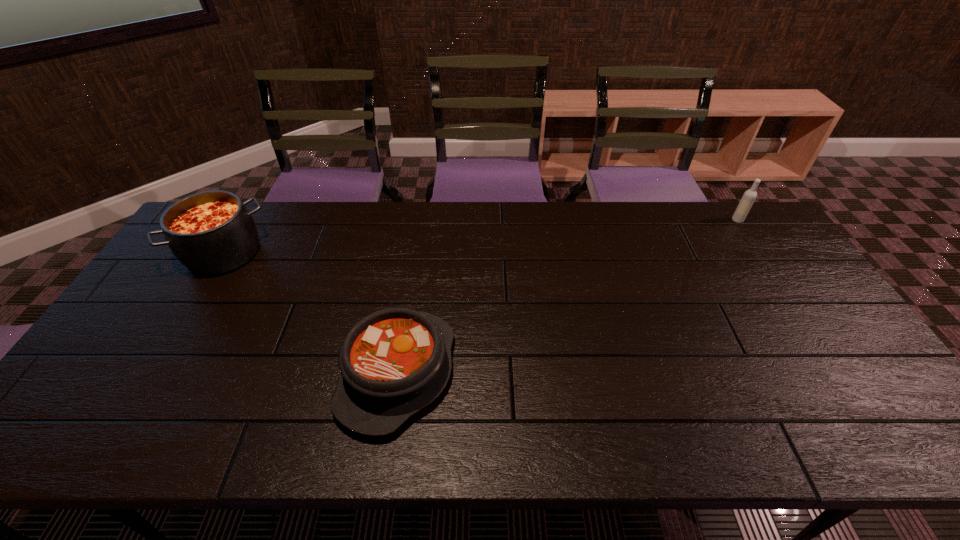
The width and height of the screenshot is (960, 540). I want to click on object that stands as the closest to the right casserole, so click(212, 232).

Choose which object is the second nearest neighbor to the farther casserole. Please provide its 2D coordinates. Your answer should be formatted as a tuple, i.e. [(x, y)], where the tuple contains the x and y coordinates of a point satisfying the conditions above.

[(746, 202)]

Where is `free space in the image that satisfies the following two spatial constraints: 1. on the front side of the farther casserole; 2. on the right side of the second object from right to left`? The image size is (960, 540). free space in the image that satisfies the following two spatial constraints: 1. on the front side of the farther casserole; 2. on the right side of the second object from right to left is located at coordinates (151, 373).

This screenshot has width=960, height=540. In order to click on free spot that satisfies the following two spatial constraints: 1. on the front side of the shortest object; 2. on the left side of the left casserole in this screenshot , I will do `click(151, 373)`.

Identify the location of vacant point that satisfies the following two spatial constraints: 1. on the back side of the taller casserole; 2. on the right side of the vodka. Image resolution: width=960 pixels, height=540 pixels. (244, 220).

Find the location of a particular element. free spot that satisfies the following two spatial constraints: 1. on the back side of the second object from right to left; 2. on the left side of the rightmost object is located at coordinates (421, 220).